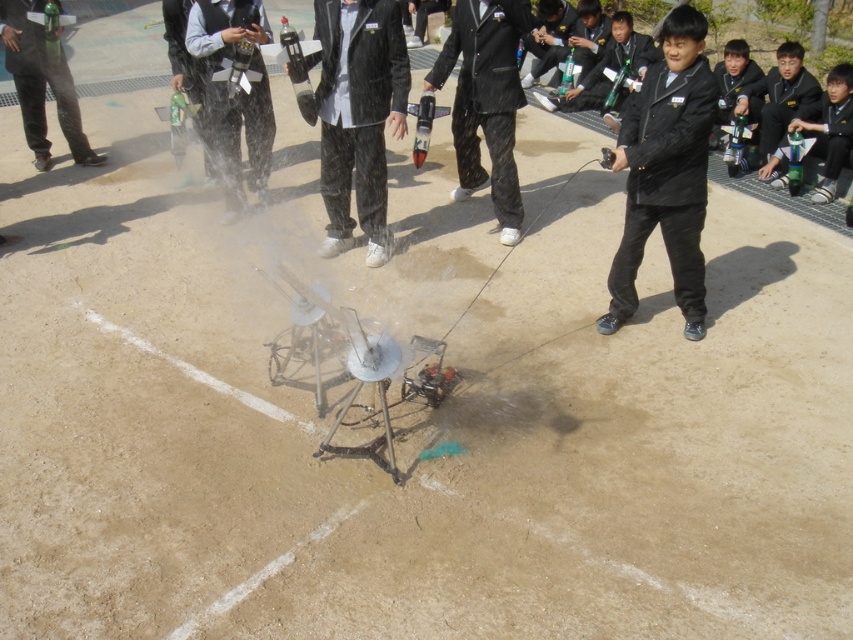
You are a photographer at the event and need to capture both the black matte suit at center and the black velvet suit at center in a single frame. Since the camera can only focus on one subject at a time, which suit should you focus on to ensure the smaller one is in clear view?

The black matte suit at center is smaller than the black velvet suit at center, so focusing on the smaller one, the black matte suit at center, will ensure it is in clear view.

You are a student participating in a science fair and need to place the black matte jacket at upper right on the table next to the brushed metal water gun at center. Considering their sizes, will the jacket fit on the table without overlapping the water gun?

The brushed metal water gun at center is wider than the black matte jacket at upper right. Since the water gun is wider, there should be enough space on the table to place the jacket next to it without overlapping.